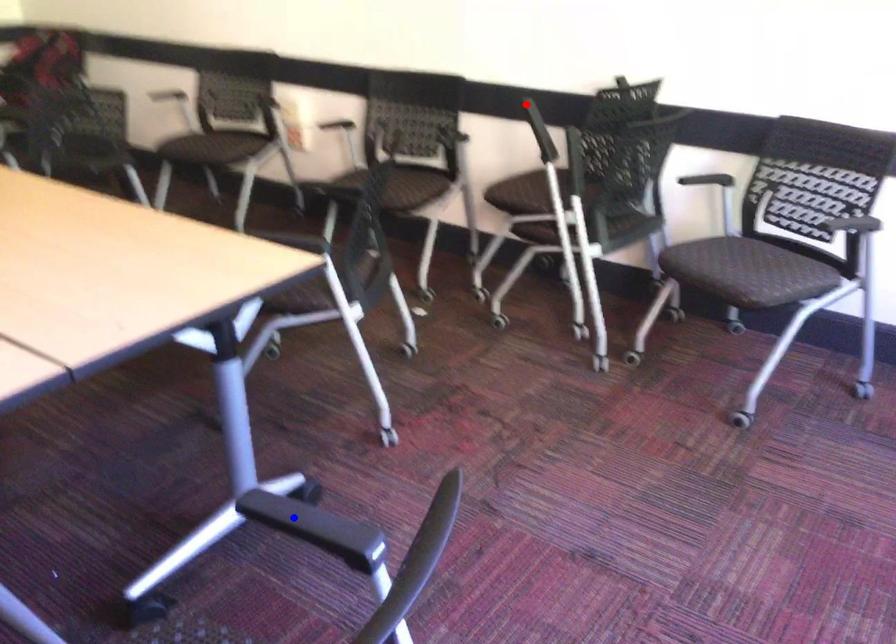
Question: Which of the two points in the image is closer to the camera?

Choices:
 (A) Blue point is closer.
 (B) Red point is closer.

Answer: (A)